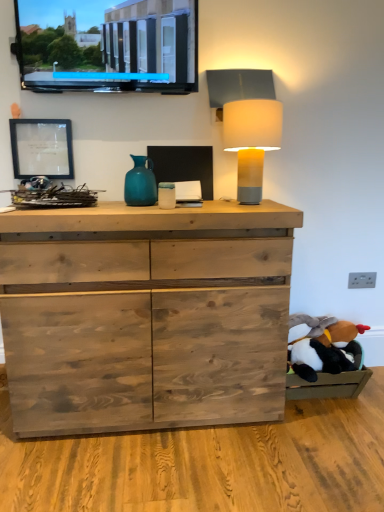
Question: Is teal glass vase at center positioned with its back to black plush toy at lower right?

Choices:
 (A) no
 (B) yes

Answer: (A)

Question: Considering the relative sizes of teal glass vase at center and black plush toy at lower right in the image provided, is teal glass vase at center smaller than black plush toy at lower right?

Choices:
 (A) no
 (B) yes

Answer: (B)

Question: Is teal glass vase at center to the right of black plush toy at lower right from the viewer's perspective?

Choices:
 (A) yes
 (B) no

Answer: (B)

Question: Is teal glass vase at center to the left of black plush toy at lower right from the viewer's perspective?

Choices:
 (A) no
 (B) yes

Answer: (B)

Question: Can you confirm if teal glass vase at center is shorter than black plush toy at lower right?

Choices:
 (A) yes
 (B) no

Answer: (B)

Question: Would you consider teal glass vase at center to be distant from black plush toy at lower right?

Choices:
 (A) yes
 (B) no

Answer: (A)

Question: Considering the relative sizes of black plush toy at lower right and teal glass vase at center in the image provided, is black plush toy at lower right taller than teal glass vase at center?

Choices:
 (A) yes
 (B) no

Answer: (B)

Question: Does black plush toy at lower right have a lesser height compared to teal glass vase at center?

Choices:
 (A) no
 (B) yes

Answer: (B)

Question: Is black plush toy at lower right at the left side of teal glass vase at center?

Choices:
 (A) no
 (B) yes

Answer: (A)

Question: From a real-world perspective, is black plush toy at lower right located beneath teal glass vase at center?

Choices:
 (A) yes
 (B) no

Answer: (A)

Question: Would you say teal glass vase at center is part of black plush toy at lower right's contents?

Choices:
 (A) no
 (B) yes

Answer: (A)

Question: Is black plush toy at lower right looking in the opposite direction of teal glass vase at center?

Choices:
 (A) yes
 (B) no

Answer: (B)

Question: Considering the relative positions of black plush toy at lower right and matte black screen at upper left in the image provided, is black plush toy at lower right to the left of matte black screen at upper left from the viewer's perspective?

Choices:
 (A) yes
 (B) no

Answer: (B)